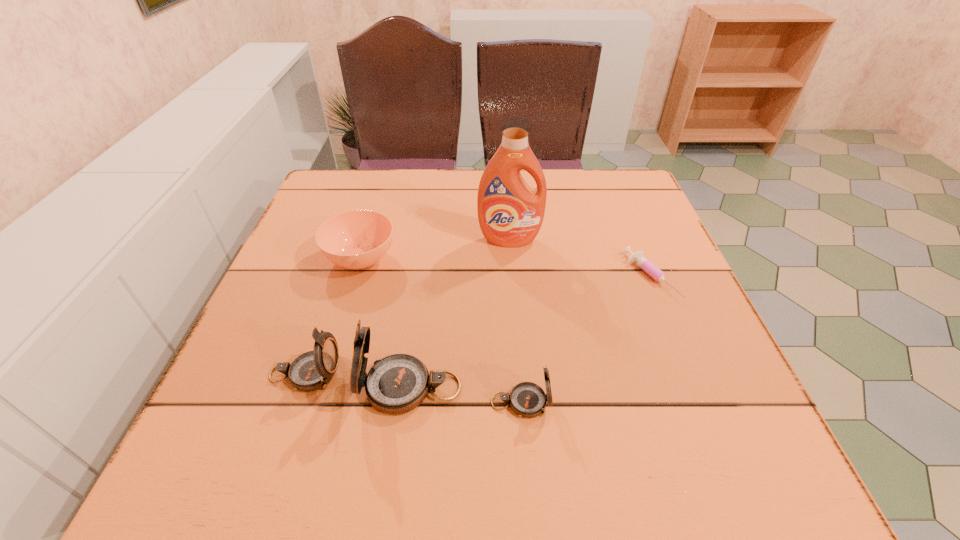
This screenshot has height=540, width=960. I want to click on free space located on the face of the second tallest object, so click(x=324, y=388).

This screenshot has height=540, width=960. I want to click on vacant space located 0.240m on the face of the second tallest object, so click(x=220, y=388).

This screenshot has height=540, width=960. In order to click on vacant space located 0.100m on the face of the rightmost compass in this screenshot , I will do `click(611, 402)`.

What are the coordinates of `free space located on the front-facing side of the detergent` in the screenshot? It's located at (512, 268).

Where is `free spot located 0.090m on the front of the soup bowl`? free spot located 0.090m on the front of the soup bowl is located at coordinates (344, 316).

Where is `blank space located 0.400m on the left of the rightmost object`? This screenshot has height=540, width=960. blank space located 0.400m on the left of the rightmost object is located at coordinates (446, 276).

The width and height of the screenshot is (960, 540). Find the location of `compass located in the left edge section of the desktop`. compass located in the left edge section of the desktop is located at coordinates (312, 370).

Where is `soup bowl located at the left edge`? soup bowl located at the left edge is located at coordinates (358, 239).

This screenshot has height=540, width=960. I want to click on object that is at the right edge, so click(653, 271).

Locate an element on the screen. Image resolution: width=960 pixels, height=540 pixels. object situated at the near left corner is located at coordinates (312, 370).